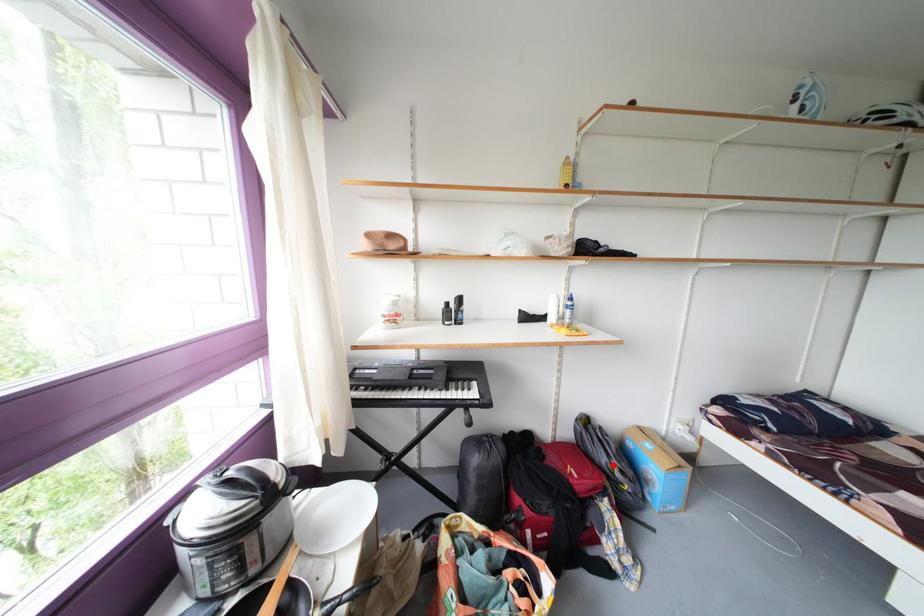
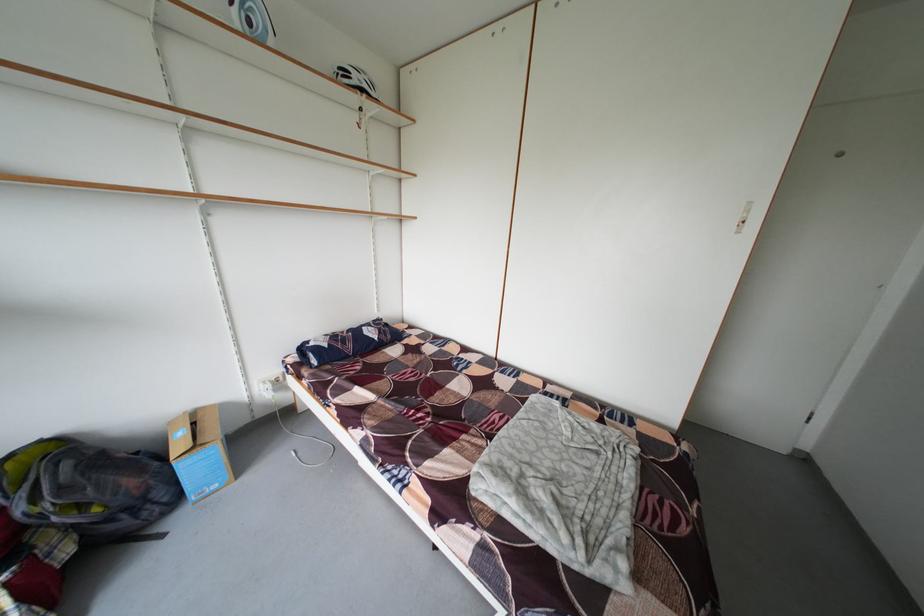
Question: A red point is marked in image1. In image2, is the corresponding 3D point closer to the camera or farther? Reply with the corresponding letter.

Choices:
 (A) The corresponding 3D point is closer.
 (B) The corresponding 3D point is farther.

Answer: (A)